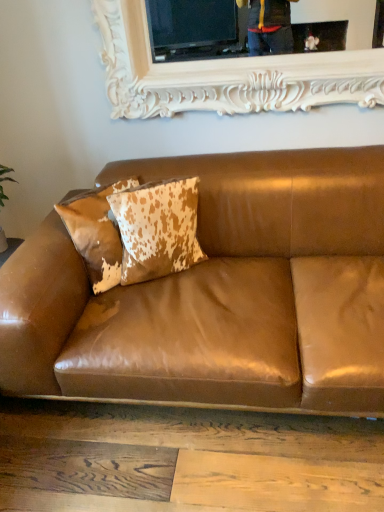
The height and width of the screenshot is (512, 384). What do you see at coordinates (157, 228) in the screenshot?
I see `cowhide pillow at upper left, the 1th pillow when ordered from right to left` at bounding box center [157, 228].

Image resolution: width=384 pixels, height=512 pixels. In order to click on brown leather couch at center in this screenshot , I will do `click(219, 294)`.

Visually, is white carved wood picture frame at upper center positioned to the left or to the right of cowhide pillow at center, marked as the 2th pillow in a right-to-left arrangement?

white carved wood picture frame at upper center is positioned on cowhide pillow at center, marked as the 2th pillow in a right-to-left arrangement,'s right side.

Is white carved wood picture frame at upper center oriented away from cowhide pillow at center, marked as the 2th pillow in a right-to-left arrangement?

No, cowhide pillow at center, marked as the 2th pillow in a right-to-left arrangement, is not at the back of white carved wood picture frame at upper center.

Which object is thinner, white carved wood picture frame at upper center or cowhide pillow at center, marked as the 2th pillow in a right-to-left arrangement?

white carved wood picture frame at upper center is thinner.

Can you tell me how much white carved wood picture frame at upper center and cowhide pillow at center, marked as the 2th pillow in a right-to-left arrangement, differ in facing direction?

40.4 degrees.

From the image's perspective, is cowhide pillow at upper left, acting as the 2th pillow starting from the left, positioned above or below white carved wood picture frame at upper center?

Clearly, from the image's perspective, cowhide pillow at upper left, acting as the 2th pillow starting from the left, is below white carved wood picture frame at upper center.

Are cowhide pillow at upper left, the 1th pillow when ordered from right to left, and white carved wood picture frame at upper center located far from each other?

No.

Who is shorter, cowhide pillow at upper left, the 1th pillow when ordered from right to left, or white carved wood picture frame at upper center?

Standing shorter between the two is cowhide pillow at upper left, the 1th pillow when ordered from right to left.

There is a cowhide pillow at upper left, the 1th pillow when ordered from right to left. Find the location of `picture frame above it (from a real-world perspective)`. picture frame above it (from a real-world perspective) is located at coordinates (224, 74).

From the image's perspective, starting from the brown leather couch at center, which pillow is the 1st one above? Please provide its 2D coordinates.

[(96, 233)]

Between cowhide pillow at center, which is counted as the first pillow, starting from the left, and brown leather couch at center, which one is positioned in front?

brown leather couch at center is closer to the camera.

How different are the orientations of cowhide pillow at center, which is counted as the first pillow, starting from the left, and brown leather couch at center in degrees?

There is a 39.5-degree angle between the facing directions of cowhide pillow at center, which is counted as the first pillow, starting from the left, and brown leather couch at center.

From a real-world perspective, is brown leather couch at center physically above cowhide pillow at center, marked as the 2th pillow in a right-to-left arrangement?

Incorrect, from a real-world perspective, brown leather couch at center is lower than cowhide pillow at center, marked as the 2th pillow in a right-to-left arrangement.

Which of these two, brown leather couch at center or cowhide pillow at center, which is counted as the first pillow, starting from the left, is bigger?

brown leather couch at center is bigger.

Considering the relative positions of brown leather couch at center and cowhide pillow at center, which is counted as the first pillow, starting from the left, in the image provided, is brown leather couch at center to the right of cowhide pillow at center, which is counted as the first pillow, starting from the left, from the viewer's perspective?

Indeed, brown leather couch at center is positioned on the right side of cowhide pillow at center, which is counted as the first pillow, starting from the left.

How different are the orientations of brown leather couch at center and cowhide pillow at center, marked as the 2th pillow in a right-to-left arrangement, in degrees?

They differ by 39.5 degrees in their facing directions.

How far apart are brown leather couch at center and cowhide pillow at upper left, acting as the 2th pillow starting from the left?

brown leather couch at center is 11.48 inches from cowhide pillow at upper left, acting as the 2th pillow starting from the left.

Who is shorter, brown leather couch at center or cowhide pillow at upper left, acting as the 2th pillow starting from the left?

With less height is cowhide pillow at upper left, acting as the 2th pillow starting from the left.

From the image's perspective, which one is positioned higher, brown leather couch at center or cowhide pillow at upper left, the 1th pillow when ordered from right to left?

cowhide pillow at upper left, the 1th pillow when ordered from right to left, is shown above in the image.

From a real-world perspective, which object rests below the other?

brown leather couch at center, from a real-world perspective.

What are the coordinates of `pillow positioned vertically above the cowhide pillow at center, marked as the 2th pillow in a right-to-left arrangement (from a real-world perspective)` in the screenshot? It's located at (157, 228).

From the image's perspective, is cowhide pillow at center, which is counted as the first pillow, starting from the left, on cowhide pillow at upper left, the 1th pillow when ordered from right to left?

Incorrect, from the image's perspective, cowhide pillow at center, which is counted as the first pillow, starting from the left, is lower than cowhide pillow at upper left, the 1th pillow when ordered from right to left.

In the image, is cowhide pillow at center, marked as the 2th pillow in a right-to-left arrangement, on the left side or the right side of cowhide pillow at upper left, acting as the 2th pillow starting from the left?

cowhide pillow at center, marked as the 2th pillow in a right-to-left arrangement, is to the left of cowhide pillow at upper left, acting as the 2th pillow starting from the left.

Considering the positions of objects cowhide pillow at center, which is counted as the first pillow, starting from the left, and cowhide pillow at upper left, the 1th pillow when ordered from right to left, in the image provided, who is in front, cowhide pillow at center, which is counted as the first pillow, starting from the left, or cowhide pillow at upper left, the 1th pillow when ordered from right to left,?

cowhide pillow at upper left, the 1th pillow when ordered from right to left, is more forward.

Are brown leather couch at center and white carved wood picture frame at upper center making contact?

No, brown leather couch at center is not with white carved wood picture frame at upper center.

The width and height of the screenshot is (384, 512). I want to click on studio couch lying below the white carved wood picture frame at upper center (from the image's perspective), so click(x=219, y=294).

From the image's perspective, does brown leather couch at center appear lower than white carved wood picture frame at upper center?

Indeed, from the image's perspective, brown leather couch at center is shown beneath white carved wood picture frame at upper center.

Who is shorter, brown leather couch at center or white carved wood picture frame at upper center?

white carved wood picture frame at upper center.

Starting from the white carved wood picture frame at upper center, which pillow is the 2nd one to the left? Please provide its 2D coordinates.

[(96, 233)]

There is a cowhide pillow at upper left, the 1th pillow when ordered from right to left. Identify the location of picture frame above it (from a real-world perspective). The width and height of the screenshot is (384, 512). [224, 74].

Estimate the real-world distances between objects in this image. Which object is further from white carved wood picture frame at upper center, cowhide pillow at center, marked as the 2th pillow in a right-to-left arrangement, or brown leather couch at center?

brown leather couch at center.

Based on their spatial positions, is cowhide pillow at center, which is counted as the first pillow, starting from the left, or white carved wood picture frame at upper center closer to cowhide pillow at upper left, acting as the 2th pillow starting from the left?

Based on the image, cowhide pillow at center, which is counted as the first pillow, starting from the left, appears to be nearer to cowhide pillow at upper left, acting as the 2th pillow starting from the left.

From the image, which object appears to be nearer to white carved wood picture frame at upper center, cowhide pillow at upper left, the 1th pillow when ordered from right to left, or brown leather couch at center?

cowhide pillow at upper left, the 1th pillow when ordered from right to left, is closer to white carved wood picture frame at upper center.

From the image, which object appears to be nearer to cowhide pillow at center, marked as the 2th pillow in a right-to-left arrangement, white carved wood picture frame at upper center or brown leather couch at center?

Among the two, brown leather couch at center is located nearer to cowhide pillow at center, marked as the 2th pillow in a right-to-left arrangement.

From the image, which object appears to be farther from white carved wood picture frame at upper center, brown leather couch at center or cowhide pillow at center, marked as the 2th pillow in a right-to-left arrangement?

Among the two, brown leather couch at center is located further to white carved wood picture frame at upper center.

Looking at the image, which one is located closer to cowhide pillow at center, which is counted as the first pillow, starting from the left, brown leather couch at center or white carved wood picture frame at upper center?

The object closer to cowhide pillow at center, which is counted as the first pillow, starting from the left, is brown leather couch at center.

Based on their spatial positions, is white carved wood picture frame at upper center or brown leather couch at center further from cowhide pillow at upper left, the 1th pillow when ordered from right to left?

white carved wood picture frame at upper center.

Based on their spatial positions, is cowhide pillow at center, marked as the 2th pillow in a right-to-left arrangement, or cowhide pillow at upper left, the 1th pillow when ordered from right to left, closer to brown leather couch at center?

Among the two, cowhide pillow at upper left, the 1th pillow when ordered from right to left, is located nearer to brown leather couch at center.

Image resolution: width=384 pixels, height=512 pixels. Find the location of `pillow that lies between white carved wood picture frame at upper center and cowhide pillow at center, which is counted as the first pillow, starting from the left, from top to bottom`. pillow that lies between white carved wood picture frame at upper center and cowhide pillow at center, which is counted as the first pillow, starting from the left, from top to bottom is located at coordinates (157, 228).

At what (x,y) coordinates should I click in order to perform the action: click on pillow between brown leather couch at center and cowhide pillow at center, marked as the 2th pillow in a right-to-left arrangement, along the z-axis. Please return your answer as a coordinate pair (x, y). The width and height of the screenshot is (384, 512). Looking at the image, I should click on (157, 228).